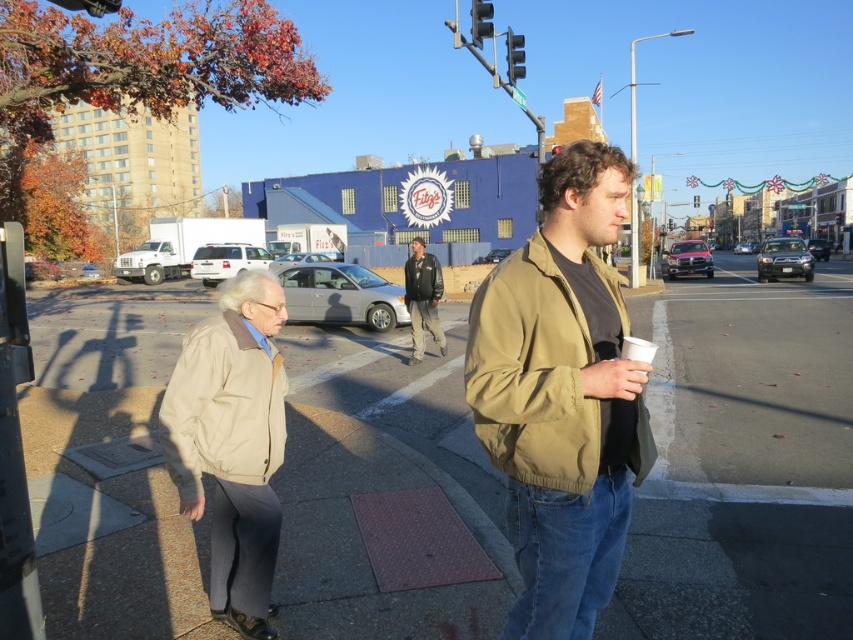
Which is more to the right, smooth concrete sidewalk at center or olive-green fabric jacket at center-right?

Positioned to the right is smooth concrete sidewalk at center.

Can you confirm if smooth concrete sidewalk at center is positioned above olive-green fabric jacket at center-right?

Yes, smooth concrete sidewalk at center is above olive-green fabric jacket at center-right.

The image size is (853, 640). I want to click on smooth concrete sidewalk at center, so click(743, 465).

Can you confirm if smooth concrete sidewalk at center is shorter than dark blue leather jacket at center?

No, smooth concrete sidewalk at center is not shorter than dark blue leather jacket at center.

Find the location of `smooth concrete sidewalk at center`. smooth concrete sidewalk at center is located at coordinates (743, 465).

At what (x,y) coordinates should I click in order to perform the action: click on smooth concrete sidewalk at center. Please return your answer as a coordinate pair (x, y). This screenshot has width=853, height=640. Looking at the image, I should click on (743, 465).

Does olive-green fabric jacket at center-right come in front of leather jacket at center?

Yes, it is in front of leather jacket at center.

Which is behind, point (582, 624) or point (425, 259)?

Point (425, 259)

Is point (569, 273) positioned after point (421, 332)?

No.

Locate an element on the screen. This screenshot has width=853, height=640. olive-green fabric jacket at center-right is located at coordinates pos(561,396).